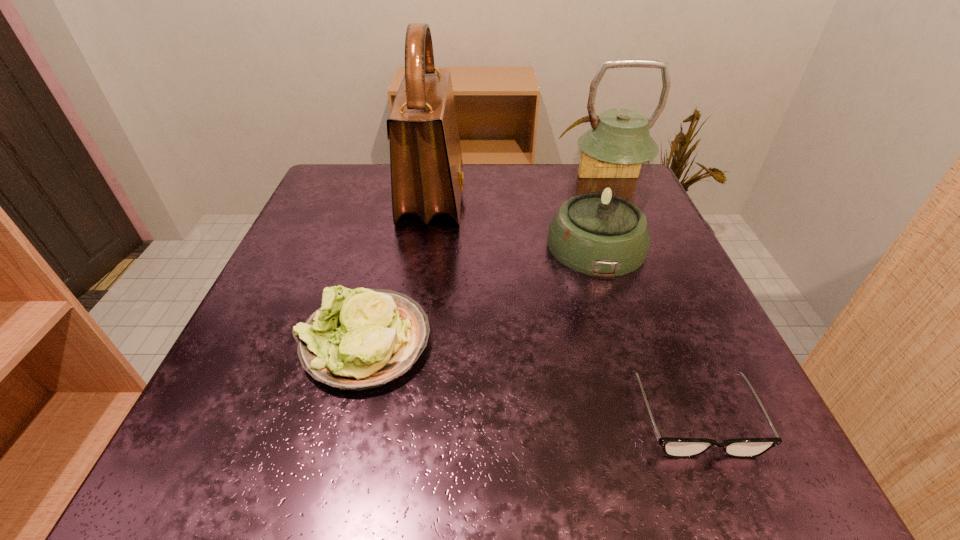
Find the location of a particular element. shoulder bag is located at coordinates (427, 178).

Where is `lantern`? lantern is located at coordinates (601, 230).

Where is `the second shortest object`? This screenshot has width=960, height=540. the second shortest object is located at coordinates (364, 338).

Identify the location of the shortest object. This screenshot has width=960, height=540. (673, 447).

Identify the location of vacant space located 0.050m on the front flap of the shoulder bag. (487, 197).

Image resolution: width=960 pixels, height=540 pixels. In order to click on free space located 0.270m on the front of the lantern in this screenshot , I will do `click(649, 410)`.

Find the location of a particular element. vacant area situated 0.070m on the right of the second shortest object is located at coordinates (475, 342).

Where is `shoulder bag present at the far edge`? shoulder bag present at the far edge is located at coordinates (427, 178).

You are a GUI agent. You are given a task and a screenshot of the screen. Output one action in this format:
    pyautogui.click(x=<x>, y=<y>)
    Task: Click on the lantern present at the far edge
    
    Given the screenshot: What is the action you would take?
    pyautogui.click(x=601, y=230)

You are a GUI agent. You are given a task and a screenshot of the screen. Output one action in this format:
    pyautogui.click(x=<x>, y=<y>)
    Task: Click on the object at the near edge
    The image size is (960, 540).
    Given the screenshot: What is the action you would take?
    pyautogui.click(x=673, y=447)